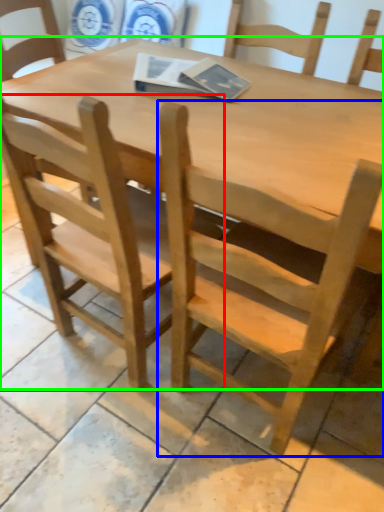
Question: Estimate the real-world distances between objects in this image. Which object is farther from chair (highlighted by a red box), chair (highlighted by a blue box) or table (highlighted by a green box)?

Choices:
 (A) chair
 (B) table

Answer: (B)